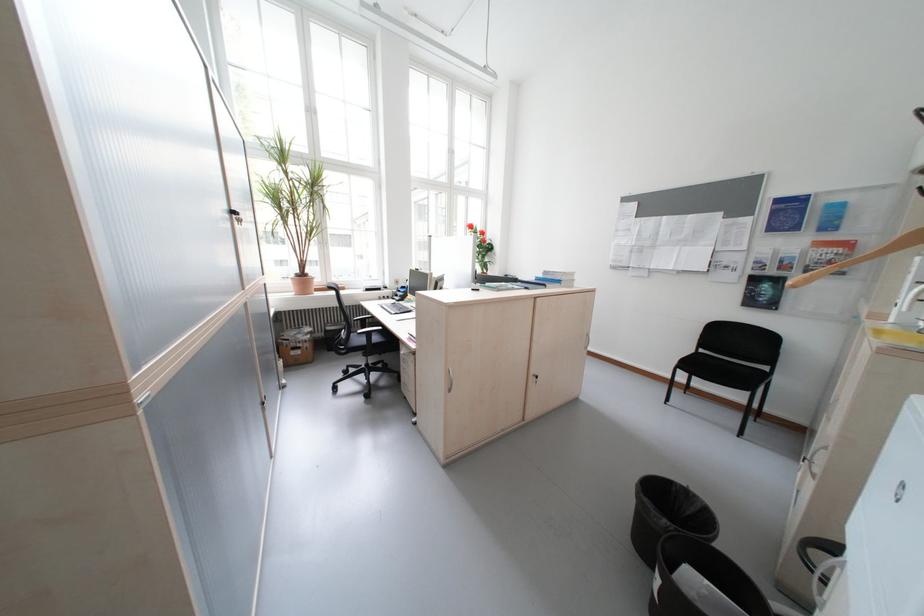
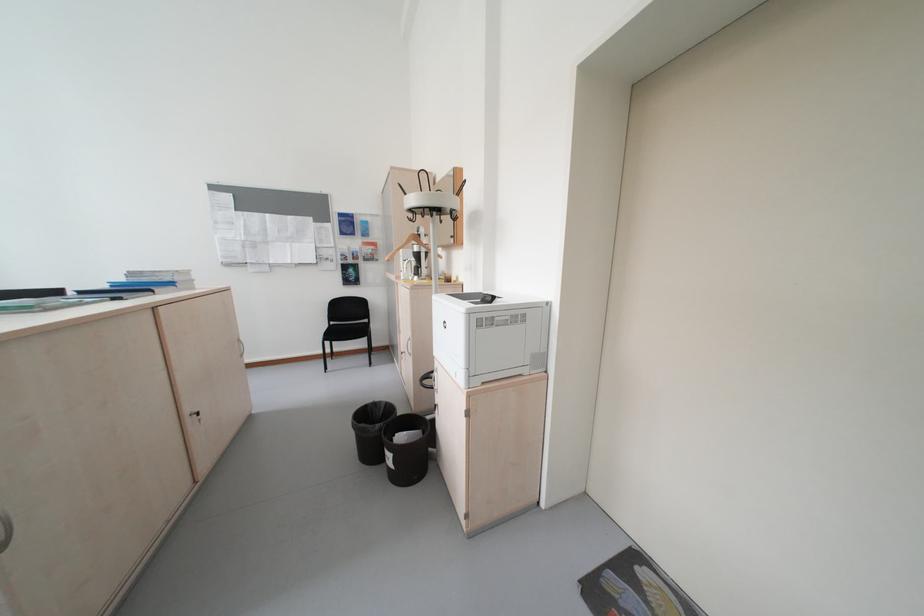
Where in the second image is the point corresponding to (542,379) from the first image?

(200, 421)